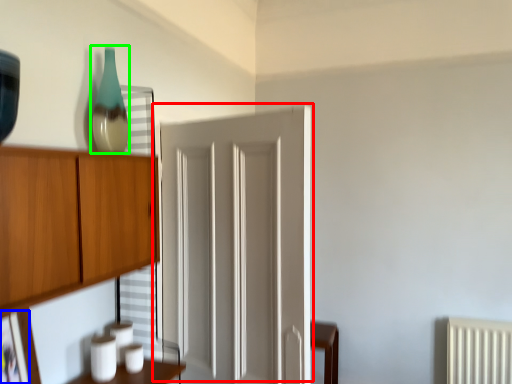
Question: Which object is the closest to the door (highlighted by a red box)? Choose among these: picture frame (highlighted by a blue box) or glass vase (highlighted by a green box).

Choices:
 (A) picture frame
 (B) glass vase

Answer: (B)